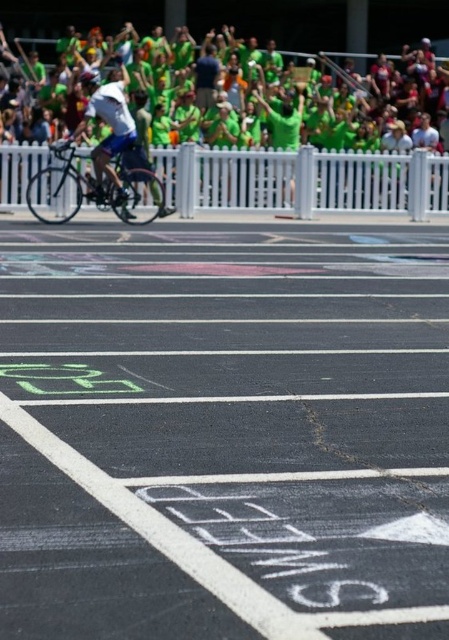
Question: Is shiny metallic bicycle at center positioned behind matte black helmet at upper center?

Choices:
 (A) yes
 (B) no

Answer: (B)

Question: Does green fabric crowd at upper center appear on the right side of shiny metallic bicycle at center?

Choices:
 (A) yes
 (B) no

Answer: (A)

Question: Estimate the real-world distances between objects in this image. Which object is farther from the green fabric crowd at upper center?

Choices:
 (A) green fabric shirt at center
 (B) matte black helmet at upper center
 (C) black asphalt race track at center

Answer: (C)

Question: Which of the following is the farthest from the observer?

Choices:
 (A) (34, 612)
 (B) (92, 86)
 (C) (45, 205)

Answer: (B)

Question: Which point is closer to the camera?

Choices:
 (A) black asphalt race track at center
 (B) green fabric shirt at center
 (C) shiny metallic bicycle at center

Answer: (A)

Question: Is green fabric crowd at upper center further to camera compared to green jersey at upper center?

Choices:
 (A) yes
 (B) no

Answer: (B)